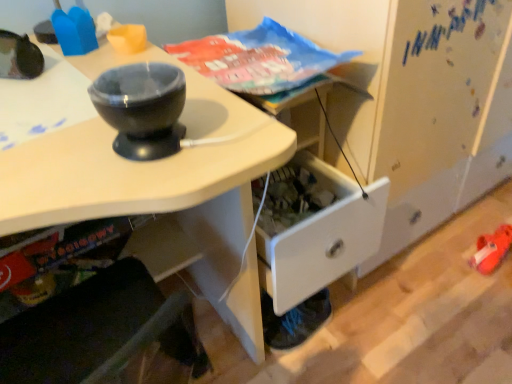
Where is `vacant region above white glossy desk at center (from a real-world perspective)`? This screenshot has height=384, width=512. vacant region above white glossy desk at center (from a real-world perspective) is located at coordinates (86, 181).